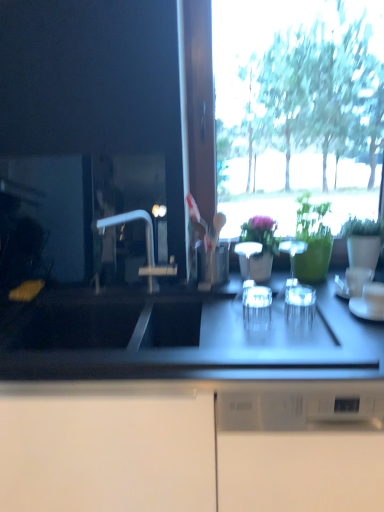
Question: Which direction should I rotate to face transparent glass at center, which is counted as the 3th tableware, starting from the left, — up or down?

Choices:
 (A) up
 (B) down

Answer: (B)

Question: Is white glossy cup at right, the first tableware positioned from the right, positioned with its back to green matte vase at center, marked as the second houseplant in a right-to-left arrangement?

Choices:
 (A) no
 (B) yes

Answer: (A)

Question: From a real-world perspective, is white glossy cup at right, the first tableware positioned from the right, positioned over green matte vase at center, which is counted as the 1th houseplant, starting from the left, based on gravity?

Choices:
 (A) yes
 (B) no

Answer: (B)

Question: Can you confirm if white glossy cup at right, the sixth tableware from the left, is smaller than green matte vase at center, marked as the second houseplant in a right-to-left arrangement?

Choices:
 (A) no
 (B) yes

Answer: (B)

Question: Is white glossy cup at right, the sixth tableware from the left, to the right of green matte vase at center, marked as the second houseplant in a right-to-left arrangement, from the viewer's perspective?

Choices:
 (A) yes
 (B) no

Answer: (A)

Question: Does white glossy cup at right, the first tableware positioned from the right, appear on the left side of green matte vase at center, which is counted as the 1th houseplant, starting from the left?

Choices:
 (A) no
 (B) yes

Answer: (A)

Question: From the image's perspective, does white glossy cup at right, the first tableware positioned from the right, appear higher than green matte vase at center, which is counted as the 1th houseplant, starting from the left?

Choices:
 (A) no
 (B) yes

Answer: (A)

Question: Is white glossy cup at center, which is counted as the 3th tableware, starting from the right, at the left side of clear glass wine glasses at center, positioned as the 5th tableware in right-to-left order?

Choices:
 (A) yes
 (B) no

Answer: (B)

Question: From a real-world perspective, is white glossy cup at center, which is counted as the 3th tableware, starting from the right, under clear glass wine glasses at center, acting as the 2th tableware starting from the left?

Choices:
 (A) no
 (B) yes

Answer: (B)

Question: Is white glossy cup at center, which is counted as the 3th tableware, starting from the right, thinner than clear glass wine glasses at center, acting as the 2th tableware starting from the left?

Choices:
 (A) no
 (B) yes

Answer: (A)

Question: Does white glossy cup at center, which is counted as the 3th tableware, starting from the right, have a greater width compared to clear glass wine glasses at center, acting as the 2th tableware starting from the left?

Choices:
 (A) no
 (B) yes

Answer: (B)

Question: Can we say white glossy cup at center, the fourth tableware viewed from the left, lies outside clear glass wine glasses at center, positioned as the 5th tableware in right-to-left order?

Choices:
 (A) yes
 (B) no

Answer: (A)

Question: From the image's perspective, is white glossy cup at center, which is counted as the 3th tableware, starting from the right, located above clear glass wine glasses at center, positioned as the 5th tableware in right-to-left order?

Choices:
 (A) yes
 (B) no

Answer: (B)

Question: From the image's perspective, is clear glass wine glasses at center, acting as the 2th tableware starting from the left, on top of green glossy vase at upper right, the 1th houseplant viewed from the right?

Choices:
 (A) no
 (B) yes

Answer: (A)